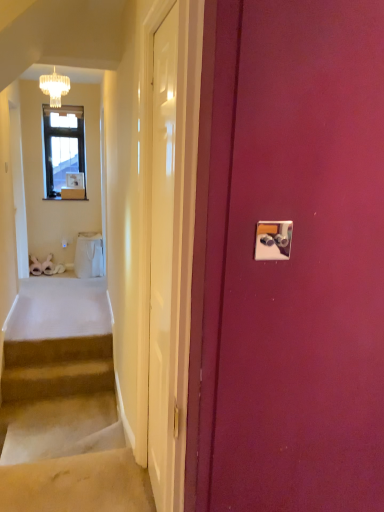
Question: In terms of size, does beige carpeted stairs at lower left, which ranks as the second stairs in top-to-bottom order, appear bigger or smaller than white glossy box at upper left?

Choices:
 (A) small
 (B) big

Answer: (B)

Question: From a real-world perspective, is beige carpeted stairs at lower left, which is counted as the first stairs, starting from the bottom, physically located above or below white glossy box at upper left?

Choices:
 (A) above
 (B) below

Answer: (B)

Question: Based on their relative distances, which object is farther from the white glossy door at center, the 1th door positioned from the left?

Choices:
 (A) crystal glass chandelier at upper left
 (B) metallic silver light switch at upper right
 (C) carpeted stairs at lower left, which ranks as the first stairs in top-to-bottom order
 (D) white glossy door at center, placed as the 2th door when sorted from left to right
 (E) white glossy box at upper left

Answer: (E)

Question: Based on their relative distances, which object is nearer to the carpeted stairs at lower left, marked as the second stairs in a bottom-to-top arrangement?

Choices:
 (A) white glossy door at center, placed as the 2th door when sorted from left to right
 (B) beige carpeted stairs at lower left, which ranks as the second stairs in top-to-bottom order
 (C) metallic silver light switch at upper right
 (D) crystal glass chandelier at upper left
 (E) white glossy door at center, the 1th door positioned from the left

Answer: (B)